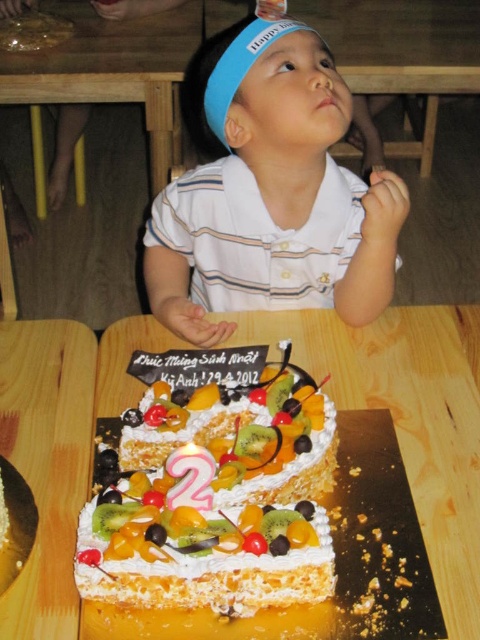
Does whipped cream topped cake at center have a larger size compared to white striped shirt at center?

No.

Who is lower down, whipped cream topped cake at center or white striped shirt at center?

Positioned lower is whipped cream topped cake at center.

Is point (109, 525) positioned behind point (406, 212)?

No.

I want to click on whipped cream topped cake at center, so 214,490.

Is point (396, 323) farther from camera compared to point (272, 109)?

Yes, it is behind point (272, 109).

Can you confirm if wooden table at lower center is thinner than white striped shirt at center?

Incorrect, wooden table at lower center's width is not less than white striped shirt at center's.

The width and height of the screenshot is (480, 640). Find the location of `wooden table at lower center`. wooden table at lower center is located at coordinates (409, 419).

This screenshot has height=640, width=480. I want to click on wooden table at lower center, so click(409, 419).

Between wooden table at lower center and whipped cream topped cake at center, which one has more height?

Standing taller between the two is wooden table at lower center.

Where is `wooden table at lower center`? wooden table at lower center is located at coordinates (409, 419).